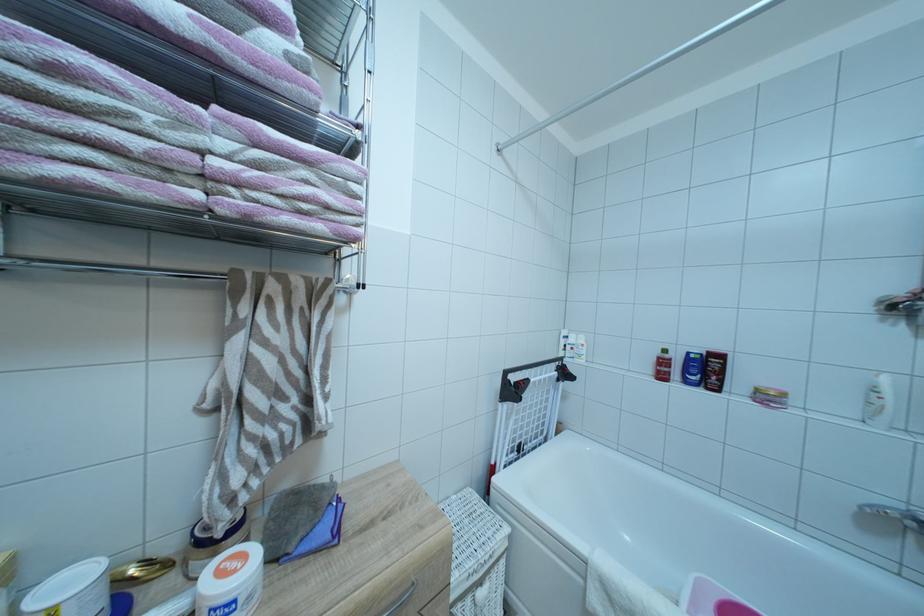
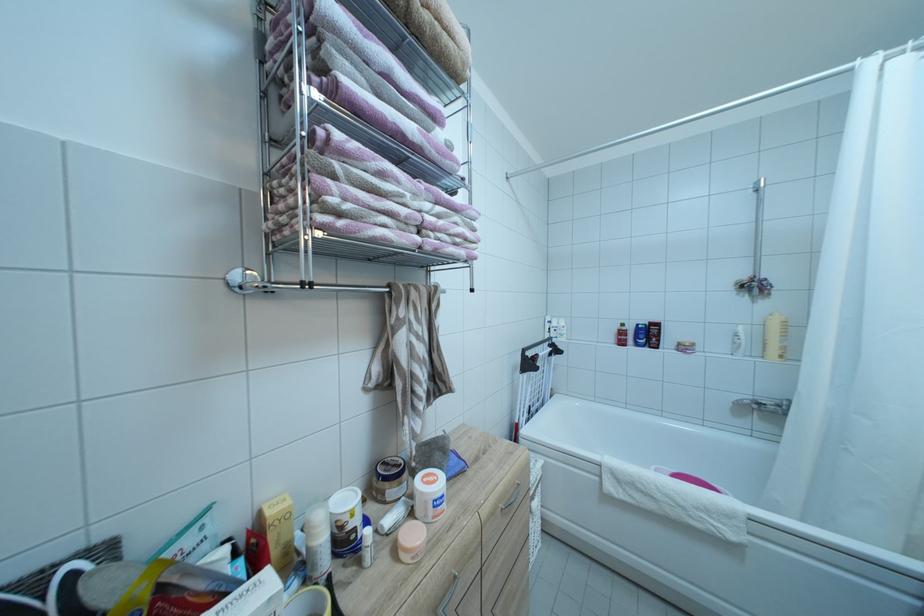
The point at (241,578) is marked in the first image. Where is the corresponding point in the second image?

(442, 487)